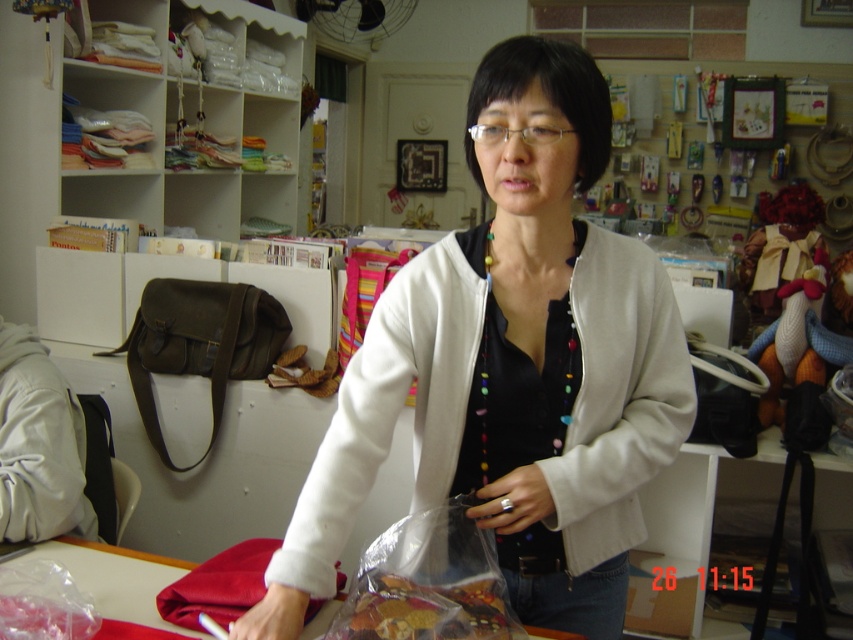
Question: Can you confirm if translucent plastic bag at center is smaller than olive green leather bag at left?

Choices:
 (A) no
 (B) yes

Answer: (B)

Question: Does white matte jacket at center appear over smooth red fabric at center?

Choices:
 (A) no
 (B) yes

Answer: (B)

Question: Which is farther from the translucent plastic bag of dried fruits at center?

Choices:
 (A) translucent plastic bag at center
 (B) white matte jacket at center
 (C) smooth red fabric at center

Answer: (C)

Question: Does translucent plastic bag of dried fruits at center have a greater width compared to smooth red fabric at center?

Choices:
 (A) no
 (B) yes

Answer: (A)

Question: Which point is farther to the camera?

Choices:
 (A) (146, 616)
 (B) (404, 588)
 (C) (639, 253)

Answer: (A)

Question: Which point is farther to the camera?

Choices:
 (A) (433, 554)
 (B) (149, 600)
 (C) (575, 372)

Answer: (B)